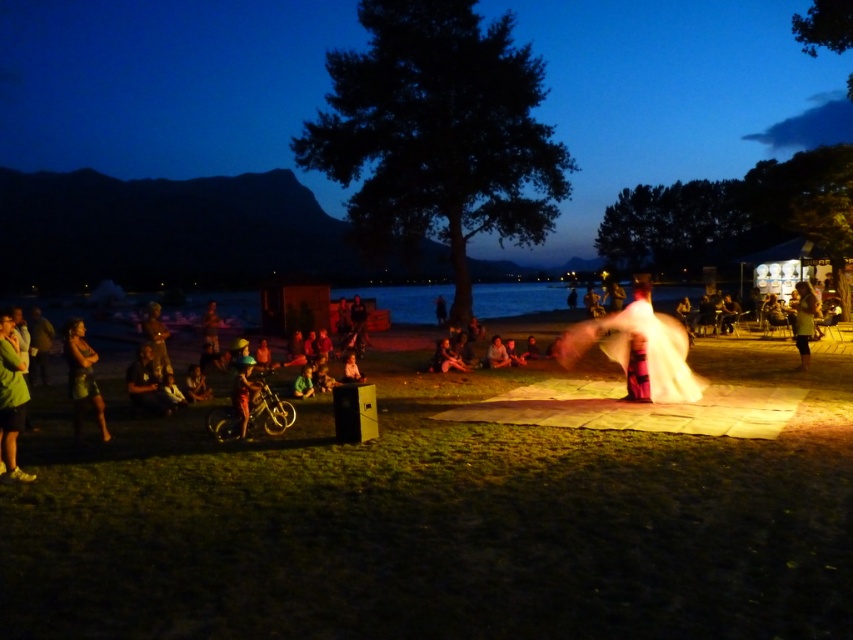
You are standing at the center of the scene. You want to find the green fabric jacket at lower left. Which direction should you look to locate it?

You should look to the lower left direction to locate the green fabric jacket at lower left since it is positioned at point (10, 401).